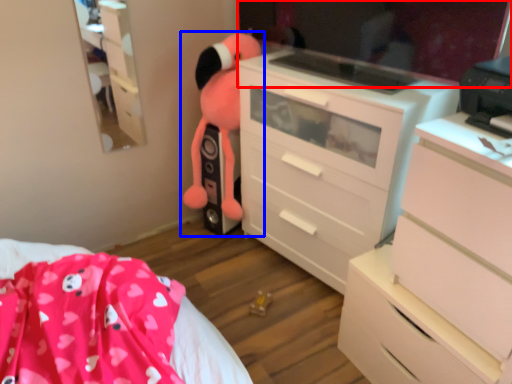
Question: Among these objects, which one is nearest to the camera, mirror (highlighted by a red box) or toy (highlighted by a blue box)?

Choices:
 (A) mirror
 (B) toy

Answer: (A)